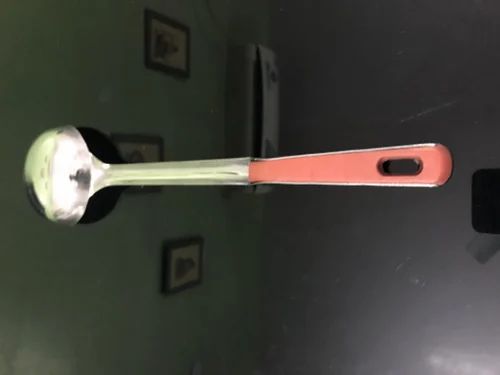
Image resolution: width=500 pixels, height=375 pixels. I want to click on handle, so click(x=356, y=164).